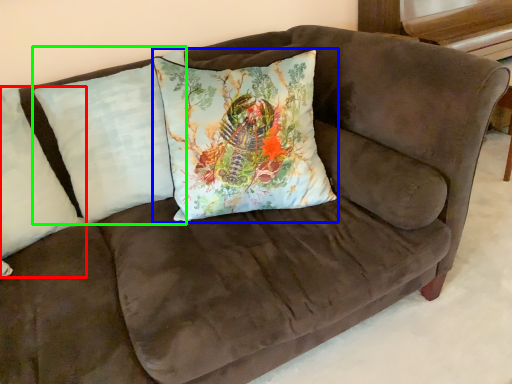
Question: Which object is the closest to the pillow (highlighted by a red box)? Choose among these: pillow (highlighted by a blue box) or pillow (highlighted by a green box).

Choices:
 (A) pillow
 (B) pillow

Answer: (B)